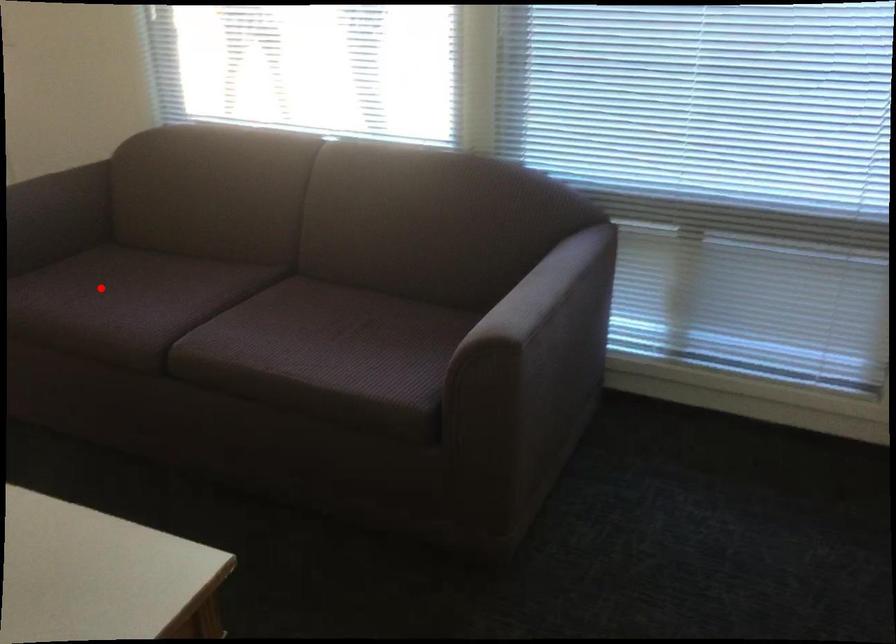
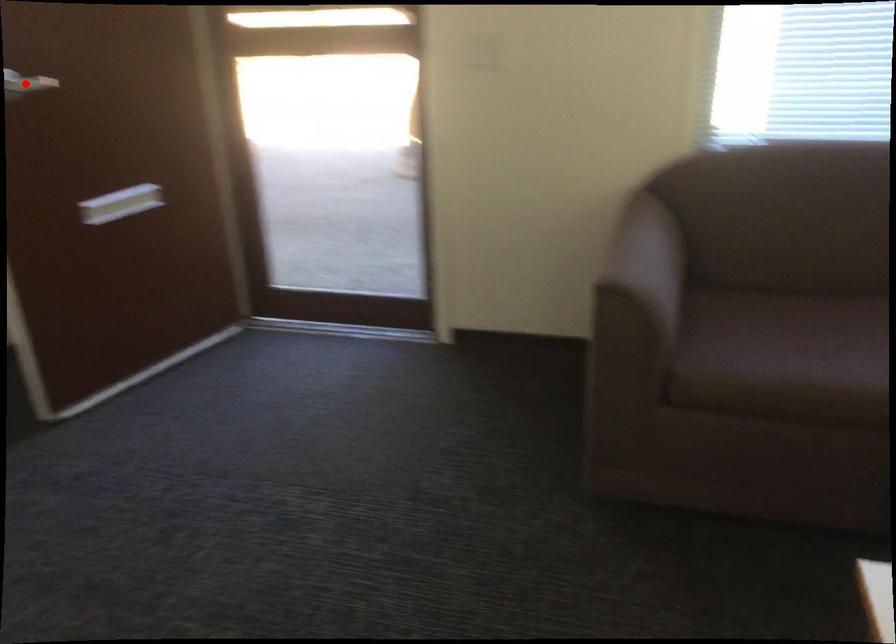
I am providing you with two images of the same scene from different viewpoints. A red point is marked on the first image and another point is marked on the second image. Are the points marked in image1 and image2 representing the same 3D position?

No